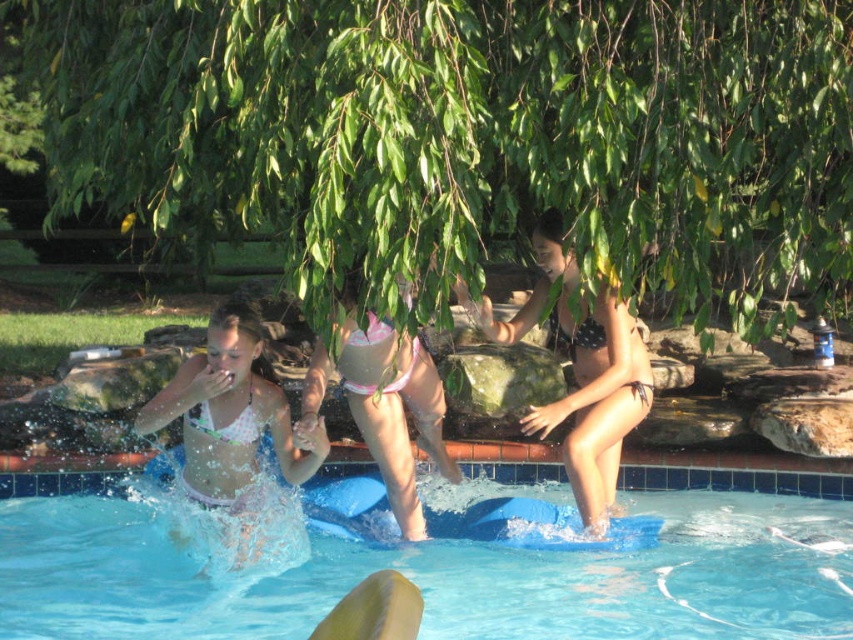
You are standing at the edge of the pool and see the blue rubber board at center and the pink fabric bikini at center. Which object is closer to you?

The blue rubber board at center is closer to you because the pink fabric bikini at center is behind it.

You are a photographer trying to capture a clear shot of the pink fabric bikini at center without any obstructions. Given the blue rubber board at center is in the scene, where is the board located relative to the bikini?

The blue rubber board at center is positioned under the pink fabric bikini at center, so it is directly beneath it and could obstruct the view unless the angle is adjusted.